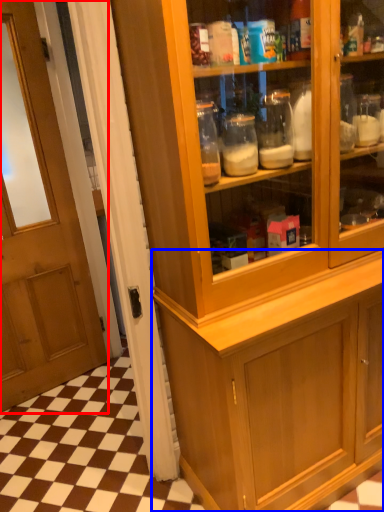
Question: Which point is closer to the camera, door (highlighted by a red box) or cabinetry (highlighted by a blue box)?

Choices:
 (A) door
 (B) cabinetry

Answer: (A)